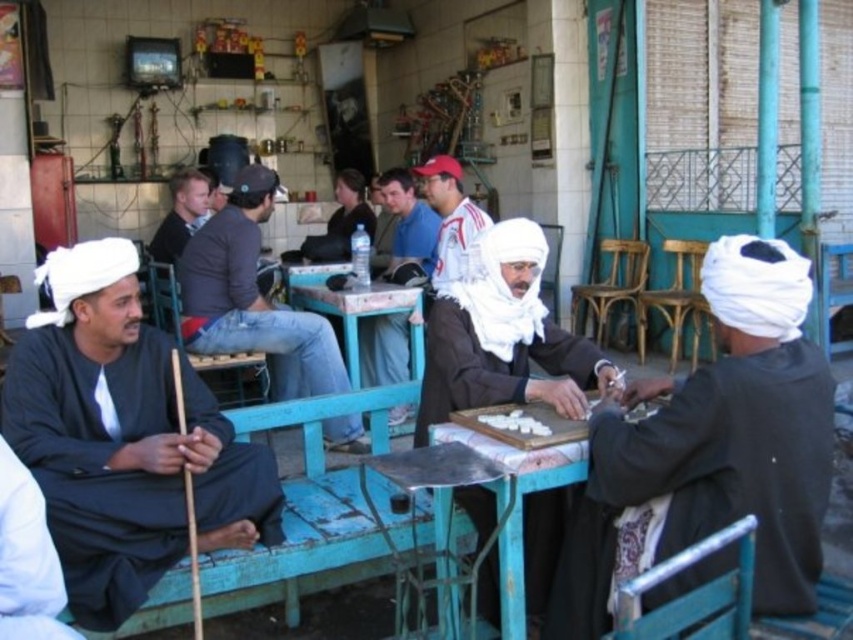
Question: Is black cotton stick at left to the right of dark gray sweater at center from the viewer's perspective?

Choices:
 (A) no
 (B) yes

Answer: (A)

Question: Estimate the real-world distances between objects in this image. Which object is farther from the dark brown fabric at center?

Choices:
 (A) dark gray sweater at center
 (B) white cotton turban at center
 (C) black cotton stick at left

Answer: (A)

Question: Observing the image, what is the correct spatial positioning of dark gray sweater at center in reference to matte black shirt at center?

Choices:
 (A) right
 (B) left

Answer: (B)

Question: Which point is farther from the camera taking this photo?

Choices:
 (A) (177, 552)
 (B) (494, 406)

Answer: (B)

Question: Can you confirm if white cotton turban at center is smaller than white matte game pieces at center?

Choices:
 (A) no
 (B) yes

Answer: (A)

Question: Which point is closer to the camera?

Choices:
 (A) (519, 504)
 (B) (792, 349)
 (C) (531, 426)
 (D) (374, 339)

Answer: (B)